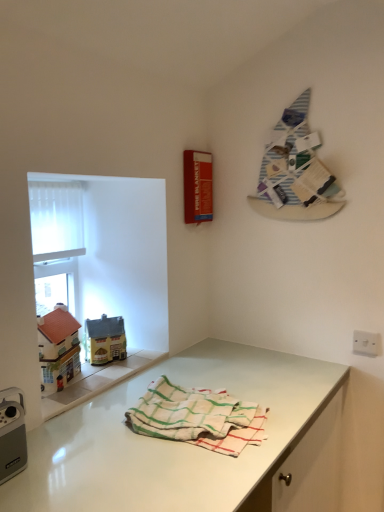
This screenshot has width=384, height=512. What are the coordinates of `vacant area that lies to the right of matte yellow house at left, which is counted as the first toy, starting from the back` in the screenshot? It's located at (138, 358).